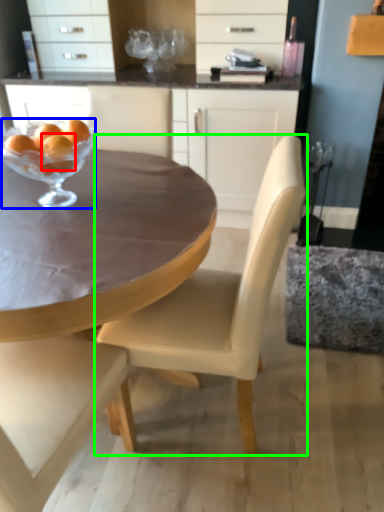
Question: Which is farther away from tangerine (highlighted by a red box)? martini glass (highlighted by a blue box) or chair (highlighted by a green box)?

Choices:
 (A) martini glass
 (B) chair

Answer: (B)